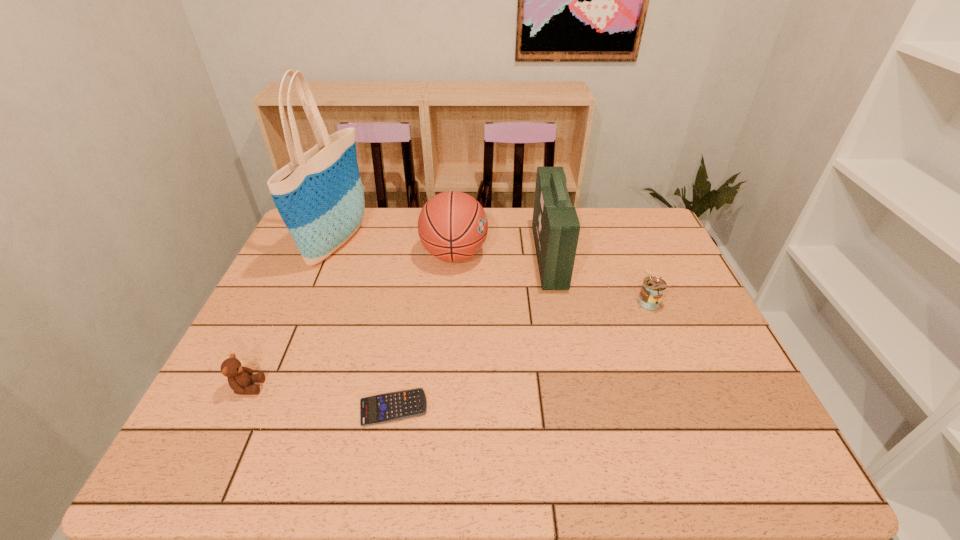
In order to click on the tallest object in this screenshot , I will do `click(319, 195)`.

The image size is (960, 540). Identify the location of the second tallest object. (555, 224).

This screenshot has width=960, height=540. What are the coordinates of `the second object from right to left` in the screenshot? It's located at (555, 224).

This screenshot has width=960, height=540. I want to click on the fourth shortest object, so click(452, 226).

Where is `the rightmost object`? the rightmost object is located at coordinates (653, 288).

The height and width of the screenshot is (540, 960). I want to click on the third nearest object, so click(653, 288).

Image resolution: width=960 pixels, height=540 pixels. What are the coordinates of `the second shortest object` in the screenshot? It's located at (239, 378).

Find the location of a particular element. This screenshot has height=540, width=960. calculator is located at coordinates (393, 406).

The width and height of the screenshot is (960, 540). In order to click on vacant space located on the front of the tallest object in this screenshot , I will do `click(299, 341)`.

Locate an element on the screen. This screenshot has height=540, width=960. free space located on the front-facing side of the second object from right to left is located at coordinates (485, 256).